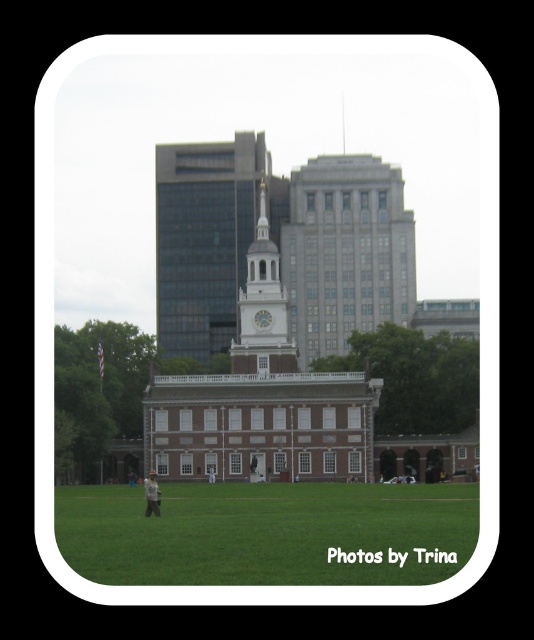
Question: Can you confirm if white brick tower at center is positioned above white glossy clock at center?

Choices:
 (A) no
 (B) yes

Answer: (B)

Question: Estimate the real-world distances between objects in this image. Which object is closer to the brown leather jacket at center?

Choices:
 (A) white painted wood clock tower at center
 (B) white brick tower at center

Answer: (A)

Question: Is white brick tower at center to the right of white glossy clock at center from the viewer's perspective?

Choices:
 (A) no
 (B) yes

Answer: (A)

Question: Which of the following is the closest to the observer?

Choices:
 (A) green grass at lower center
 (B) white glossy clock at center

Answer: (A)

Question: Which point is closer to the camera?

Choices:
 (A) (315, 508)
 (B) (208, 355)
 (C) (145, 490)

Answer: (A)

Question: Can you confirm if white painted wood clock tower at center is positioned above white glossy clock at center?

Choices:
 (A) no
 (B) yes

Answer: (B)